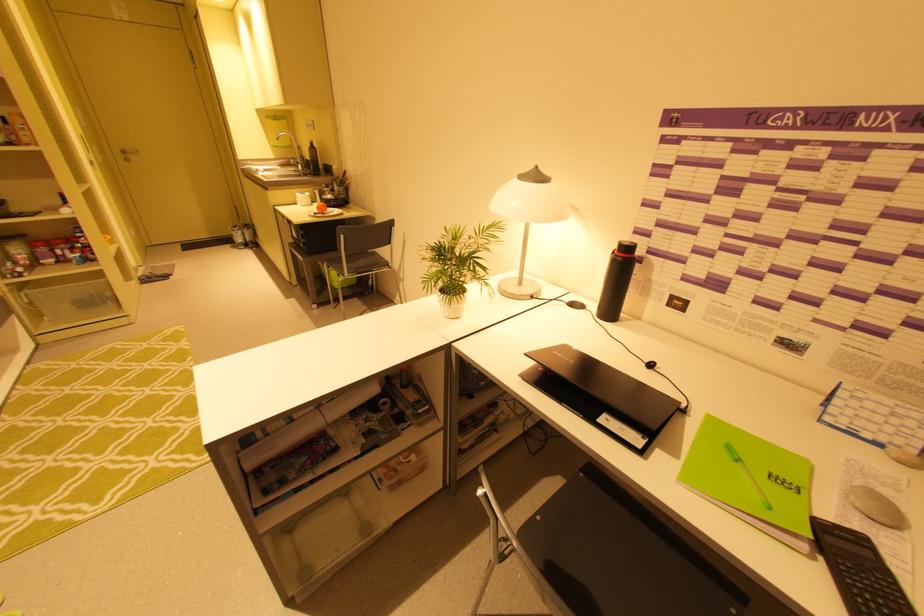
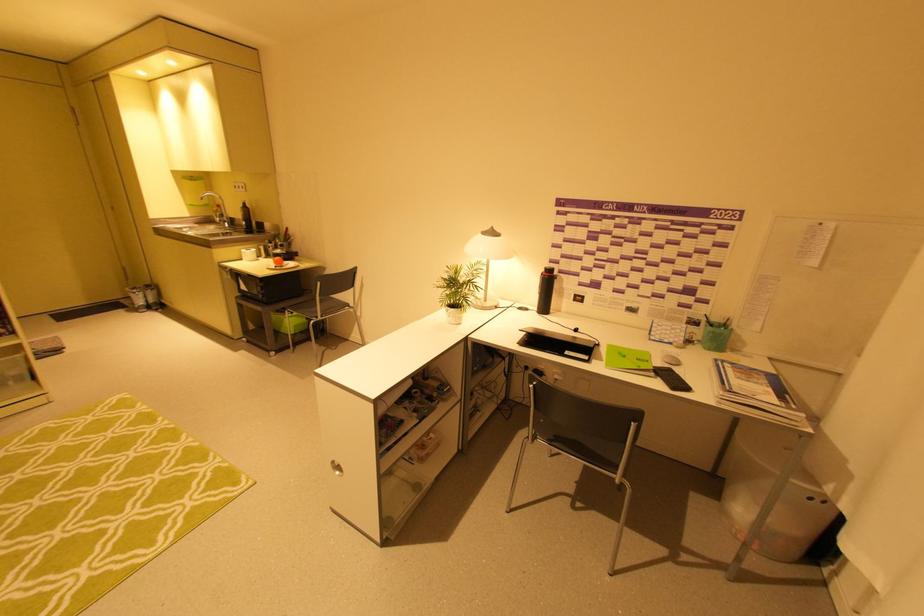
Locate, in the second image, the point that corresponds to (313,146) in the first image.

(246, 206)